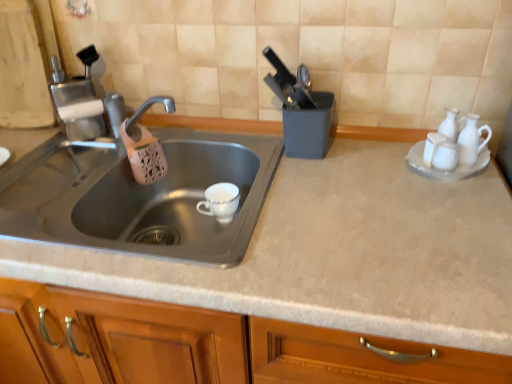
What do you see at coordinates (220, 201) in the screenshot? The image size is (512, 384). I see `white porcelain cup at sink, positioned as the third tableware in right-to-left order` at bounding box center [220, 201].

Describe the element at coordinates (432, 146) in the screenshot. I see `white glossy salt shaker at upper right, positioned as the 2th tableware in right-to-left order` at that location.

What do you see at coordinates (139, 195) in the screenshot?
I see `stainless steel sink at left` at bounding box center [139, 195].

What are the coordinates of `matte gray countertop at center` in the screenshot? It's located at (337, 254).

Is white ceramic pitcher at right, the first tableware positioned from the right, taller or shorter than matte plastic knife block at upper right?

In the image, white ceramic pitcher at right, the first tableware positioned from the right, appears to be shorter than matte plastic knife block at upper right.

Is matte plastic knife block at upper right completely or partially inside white ceramic pitcher at right, the first tableware positioned from the right?

No, matte plastic knife block at upper right is not surrounded by white ceramic pitcher at right, the first tableware positioned from the right.

Is white ceramic pitcher at right, which ranks as the first tableware in front-to-back order, further to the viewer compared to matte plastic knife block at upper right?

No, the depth of white ceramic pitcher at right, which ranks as the first tableware in front-to-back order, is less than that of matte plastic knife block at upper right.

How far apart are white ceramic pitcher at right, which appears as the third tableware when viewed from the left, and matte plastic knife block at upper right?

white ceramic pitcher at right, which appears as the third tableware when viewed from the left, is 33.70 centimeters from matte plastic knife block at upper right.

Does point (461, 151) appear closer or farther from the camera than point (207, 196)?

Clearly, point (461, 151) is closer to the camera than point (207, 196).

Which object is wider, white ceramic pitcher at right, which ranks as the first tableware in front-to-back order, or white porcelain cup at sink, positioned as the third tableware in right-to-left order?

With larger width is white porcelain cup at sink, positioned as the third tableware in right-to-left order.

From the image's perspective, is white ceramic pitcher at right, which appears as the third tableware when viewed from the left, on top of white porcelain cup at sink, which appears as the 1th tableware when viewed from the left?

Indeed, from the image's perspective, white ceramic pitcher at right, which appears as the third tableware when viewed from the left, is shown above white porcelain cup at sink, which appears as the 1th tableware when viewed from the left.

How distant is white ceramic pitcher at right, which ranks as the first tableware in front-to-back order, from white porcelain cup at sink, marked as the 3th tableware in a front-to-back arrangement?

20.96 inches.

Considering the sizes of objects matte plastic knife block at upper right and matte gray countertop at center in the image provided, who is thinner, matte plastic knife block at upper right or matte gray countertop at center?

With smaller width is matte plastic knife block at upper right.

From the image's perspective, is matte plastic knife block at upper right on top of matte gray countertop at center?

Yes, from the image's perspective, matte plastic knife block at upper right is above matte gray countertop at center.

Which is behind, point (319, 96) or point (446, 330)?

The point (319, 96) is farther from the camera.

From a real-world perspective, is matte plastic knife block at upper right located beneath matte gray countertop at center?

No, from a real-world perspective, matte plastic knife block at upper right is not beneath matte gray countertop at center.

Considering the positions of objects matte plastic knife block at upper right and white porcelain cup at sink, marked as the 3th tableware in a front-to-back arrangement, in the image provided, who is behind, matte plastic knife block at upper right or white porcelain cup at sink, marked as the 3th tableware in a front-to-back arrangement,?

white porcelain cup at sink, marked as the 3th tableware in a front-to-back arrangement, is further away from the camera.

Can you confirm if matte plastic knife block at upper right is bigger than white porcelain cup at sink, positioned as the third tableware in right-to-left order?

Indeed, matte plastic knife block at upper right has a larger size compared to white porcelain cup at sink, positioned as the third tableware in right-to-left order.

Is matte plastic knife block at upper right positioned beyond the bounds of white porcelain cup at sink, positioned as the third tableware in right-to-left order?

Yes, matte plastic knife block at upper right is located beyond the bounds of white porcelain cup at sink, positioned as the third tableware in right-to-left order.

What's the angular difference between matte plastic knife block at upper right and white porcelain cup at sink, which appears as the 1th tableware when viewed from the left,'s facing directions?

There is a 2.05-degree angle between the facing directions of matte plastic knife block at upper right and white porcelain cup at sink, which appears as the 1th tableware when viewed from the left.

Are white ceramic saucer at right and stainless steel sink at left located far from each other?

No, white ceramic saucer at right is not far away from stainless steel sink at left.

From the image's perspective, which is above, white ceramic saucer at right or stainless steel sink at left?

white ceramic saucer at right is shown above in the image.

Can you confirm if white ceramic saucer at right is positioned to the left of stainless steel sink at left?

No.

The height and width of the screenshot is (384, 512). Find the location of `appliance above the white glossy salt shaker at upper right, which is the second tableware in left-to-right order (from a real-world perspective)`. appliance above the white glossy salt shaker at upper right, which is the second tableware in left-to-right order (from a real-world perspective) is located at coordinates (301, 110).

Would you say white glossy salt shaker at upper right, arranged as the 2th tableware when viewed from the back, is outside matte plastic knife block at upper right?

Yes, white glossy salt shaker at upper right, arranged as the 2th tableware when viewed from the back, is located beyond the bounds of matte plastic knife block at upper right.

Who is taller, white glossy salt shaker at upper right, positioned as the 2th tableware in right-to-left order, or matte plastic knife block at upper right?

With more height is matte plastic knife block at upper right.

Can you tell me how much white glossy salt shaker at upper right, positioned as the 2th tableware in right-to-left order, and matte plastic knife block at upper right differ in facing direction?

The angular difference between white glossy salt shaker at upper right, positioned as the 2th tableware in right-to-left order, and matte plastic knife block at upper right is 3.76 degrees.

Is matte gray countertop at center located outside white ceramic saucer at right?

matte gray countertop at center is positioned outside white ceramic saucer at right.

Considering the sizes of objects matte gray countertop at center and white ceramic saucer at right in the image provided, who is shorter, matte gray countertop at center or white ceramic saucer at right?

With less height is white ceramic saucer at right.

Who is more distant, matte gray countertop at center or white ceramic saucer at right?

Positioned behind is white ceramic saucer at right.

The height and width of the screenshot is (384, 512). I want to click on appliance beneath the white ceramic pitcher at right, placed as the 3th tableware when sorted from back to front (from a real-world perspective), so click(x=301, y=110).

Identify the location of the 2nd tableware to the right when counting from the white porcelain cup at sink, which appears as the 1th tableware when viewed from the left. Image resolution: width=512 pixels, height=384 pixels. (471, 140).

From the image, which object appears to be farther from white ceramic pitcher at right, which appears as the third tableware when viewed from the left, white porcelain cup at sink, positioned as the third tableware in right-to-left order, or white ceramic saucer at right?

Among the two, white porcelain cup at sink, positioned as the third tableware in right-to-left order, is located further to white ceramic pitcher at right, which appears as the third tableware when viewed from the left.

Looking at the image, which one is located closer to white glossy salt shaker at upper right, arranged as the 2th tableware when viewed from the back, white ceramic pitcher at right, the first tableware positioned from the right, or stainless steel sink at left?

white ceramic pitcher at right, the first tableware positioned from the right, is closer to white glossy salt shaker at upper right, arranged as the 2th tableware when viewed from the back.

Estimate the real-world distances between objects in this image. Which object is further from white glossy salt shaker at upper right, positioned as the second tableware in front-to-back order, matte gray countertop at center or matte plastic knife block at upper right?

matte gray countertop at center lies further to white glossy salt shaker at upper right, positioned as the second tableware in front-to-back order, than the other object.

When comparing their distances from matte gray countertop at center, does white porcelain cup at sink, positioned as the third tableware in right-to-left order, or stainless steel sink at left seem further?

white porcelain cup at sink, positioned as the third tableware in right-to-left order.

Which object lies nearer to the anchor point white ceramic saucer at right, stainless steel sink at left or matte gray countertop at center?

matte gray countertop at center.

Looking at the image, which one is located further to white glossy salt shaker at upper right, which is the second tableware in left-to-right order, matte plastic knife block at upper right or matte gray countertop at center?

matte gray countertop at center is positioned further to the anchor white glossy salt shaker at upper right, which is the second tableware in left-to-right order.

When comparing their distances from matte plastic knife block at upper right, does white ceramic saucer at right or matte gray countertop at center seem further?

white ceramic saucer at right is further to matte plastic knife block at upper right.

Which object lies nearer to the anchor point matte gray countertop at center, white porcelain cup at sink, positioned as the third tableware in right-to-left order, or white ceramic pitcher at right, the first tableware positioned from the right?

Among the two, white ceramic pitcher at right, the first tableware positioned from the right, is located nearer to matte gray countertop at center.

Where is `tableware located between white porcelain cup at sink, positioned as the third tableware in right-to-left order, and white ceramic saucer at right in the left-right direction`? tableware located between white porcelain cup at sink, positioned as the third tableware in right-to-left order, and white ceramic saucer at right in the left-right direction is located at coordinates (432, 146).

Image resolution: width=512 pixels, height=384 pixels. I want to click on saucer located between stainless steel sink at left and white ceramic pitcher at right, which appears as the third tableware when viewed from the left, in the left-right direction, so click(442, 170).

Where is `appliance between stainless steel sink at left and white ceramic saucer at right`? The height and width of the screenshot is (384, 512). appliance between stainless steel sink at left and white ceramic saucer at right is located at coordinates (301, 110).

This screenshot has width=512, height=384. I want to click on countertop between white porcelain cup at sink, positioned as the third tableware in right-to-left order, and white ceramic saucer at right, so click(x=337, y=254).